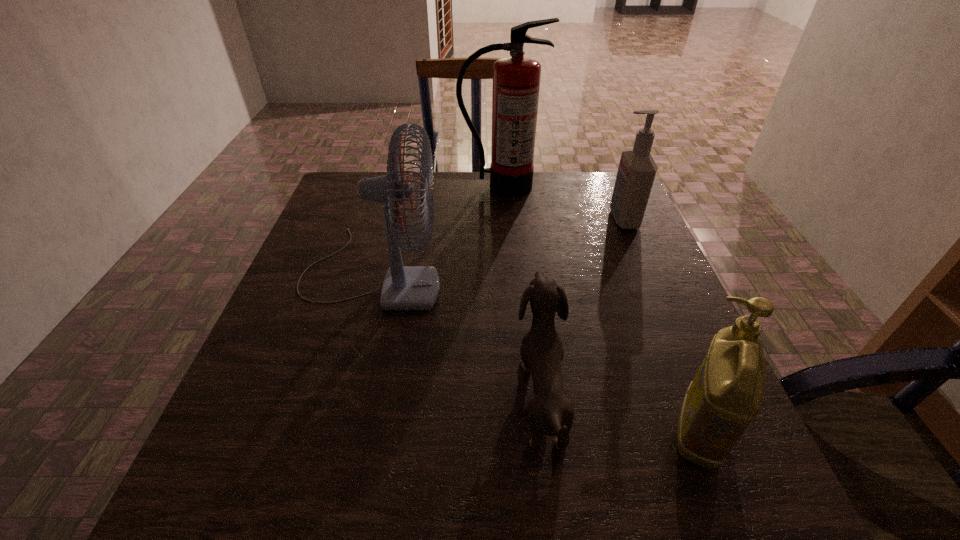
This screenshot has height=540, width=960. Find the location of `free location that satisfies the following two spatial constraints: 1. on the front label of the cleansing agent; 2. on the front side of the detergent`. free location that satisfies the following two spatial constraints: 1. on the front label of the cleansing agent; 2. on the front side of the detergent is located at coordinates (712, 431).

Where is `free space that satisfies the following two spatial constraints: 1. at the face of the detergent; 2. on the right side of the puppy`? The width and height of the screenshot is (960, 540). free space that satisfies the following two spatial constraints: 1. at the face of the detergent; 2. on the right side of the puppy is located at coordinates (546, 431).

Where is `blank area in the image that satisfies the following two spatial constraints: 1. on the front-facing side of the fan; 2. on the left side of the fourth tallest object`? This screenshot has width=960, height=540. blank area in the image that satisfies the following two spatial constraints: 1. on the front-facing side of the fan; 2. on the left side of the fourth tallest object is located at coordinates pos(328,431).

Identify the location of free location that satisfies the following two spatial constraints: 1. on the back side of the detergent; 2. on the front-facing side of the fan. (636, 273).

Locate an element on the screen. vacant space that satisfies the following two spatial constraints: 1. on the front-facing side of the second shortest object; 2. on the right side of the farthest object is located at coordinates 516,431.